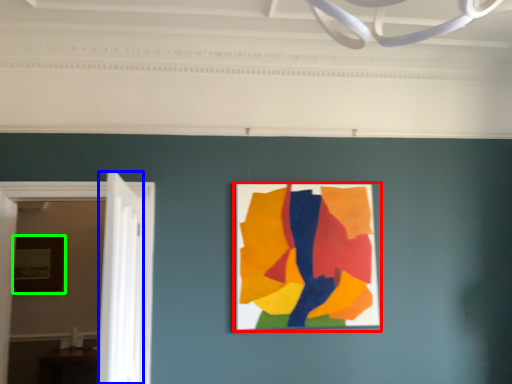
Question: Based on their relative distances, which object is nearer to picture frame (highlighted by a red box)? Choose from door (highlighted by a blue box) and picture frame (highlighted by a green box).

Choices:
 (A) door
 (B) picture frame

Answer: (A)